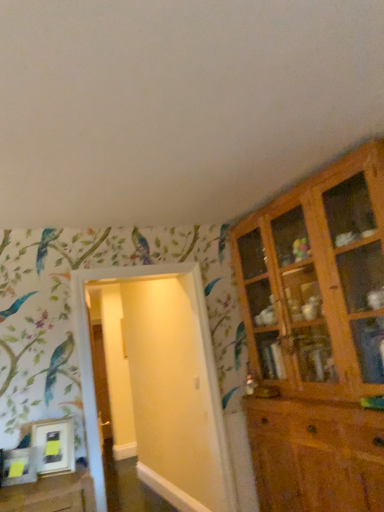
The height and width of the screenshot is (512, 384). What are the coordinates of `white glossy door at center` in the screenshot? It's located at (163, 387).

The image size is (384, 512). What do you see at coordinates (163, 387) in the screenshot? I see `white glossy door at center` at bounding box center [163, 387].

Find the location of a particular element. The width and height of the screenshot is (384, 512). wooden cabinet at right is located at coordinates (317, 338).

Describe the element at coordinates (317, 338) in the screenshot. I see `wooden cabinet at right` at that location.

The image size is (384, 512). What are the coordinates of `white glossy door at center` in the screenshot? It's located at (163, 387).

Considering the positions of objects white glossy door at center and wooden cabinet at right in the image provided, who is more to the right, white glossy door at center or wooden cabinet at right?

Positioned to the right is wooden cabinet at right.

Does white glossy door at center lie behind wooden cabinet at right?

Yes, white glossy door at center is further from the viewer.

Is point (146, 426) behind point (276, 228)?

Yes, point (146, 426) is farther from viewer.

From the image's perspective, does white glossy door at center appear higher than wooden cabinet at right?

No, from the image's perspective, white glossy door at center is not on top of wooden cabinet at right.

From a real-world perspective, is white glossy door at center positioned above or below wooden cabinet at right?

From a real-world perspective, white glossy door at center is physically below wooden cabinet at right.

Considering the relative sizes of white glossy door at center and wooden cabinet at right in the image provided, is white glossy door at center thinner than wooden cabinet at right?

Yes.

Does white glossy door at center have a greater height compared to wooden cabinet at right?

In fact, white glossy door at center may be shorter than wooden cabinet at right.

Considering the sizes of objects white glossy door at center and wooden cabinet at right in the image provided, who is smaller, white glossy door at center or wooden cabinet at right?

white glossy door at center.

Looking at this image, does white glossy door at center contain wooden cabinet at right?

No.

Is white glossy door at center placed right next to wooden cabinet at right?

No, white glossy door at center is not beside wooden cabinet at right.

Could you tell me if white glossy door at center is turned towards wooden cabinet at right?

No.

How much distance is there between white glossy door at center and wooden cabinet at right?

A distance of 38.91 inches exists between white glossy door at center and wooden cabinet at right.

Find the location of a particular element. This screenshot has width=384, height=512. cupboard located on the right of white glossy door at center is located at coordinates (317, 338).

Which is more to the right, wooden cabinet at right or white glossy door at center?

wooden cabinet at right.

Which object is closer to the camera, wooden cabinet at right or white glossy door at center?

Positioned in front is wooden cabinet at right.

Considering the positions of point (273, 332) and point (90, 426), is point (273, 332) closer or farther from the camera than point (90, 426)?

Point (273, 332).

From the image's perspective, would you say wooden cabinet at right is shown under white glossy door at center?

Incorrect, from the image's perspective, wooden cabinet at right is higher than white glossy door at center.

From a real-world perspective, who is located lower, wooden cabinet at right or white glossy door at center?

In real-world perspective, white glossy door at center is lower.

Consider the image. Considering the sizes of wooden cabinet at right and white glossy door at center in the image, is wooden cabinet at right wider or thinner than white glossy door at center?

Considering their sizes, wooden cabinet at right looks broader than white glossy door at center.

Between wooden cabinet at right and white glossy door at center, which one has less height?

white glossy door at center is shorter.

Can you confirm if wooden cabinet at right is bigger than white glossy door at center?

Indeed, wooden cabinet at right has a larger size compared to white glossy door at center.

Can white glossy door at center be found inside wooden cabinet at right?

Actually, white glossy door at center is outside wooden cabinet at right.

Would you consider wooden cabinet at right to be distant from white glossy door at center?

No, there isn't a large distance between wooden cabinet at right and white glossy door at center.

Is wooden cabinet at right facing towards white glossy door at center?

Yes, wooden cabinet at right faces towards white glossy door at center.

How different are the orientations of wooden cabinet at right and white glossy door at center in degrees?

89.2 degrees.

Image resolution: width=384 pixels, height=512 pixels. What are the coordinates of `door below the wooden cabinet at right (from the image's perspective)` in the screenshot? It's located at (163, 387).

The height and width of the screenshot is (512, 384). I want to click on door on the left of wooden cabinet at right, so click(x=163, y=387).

At what (x,y) coordinates should I click in order to perform the action: click on cupboard to the right of white glossy door at center. Please return your answer as a coordinate pair (x, y). Image resolution: width=384 pixels, height=512 pixels. Looking at the image, I should click on (317, 338).